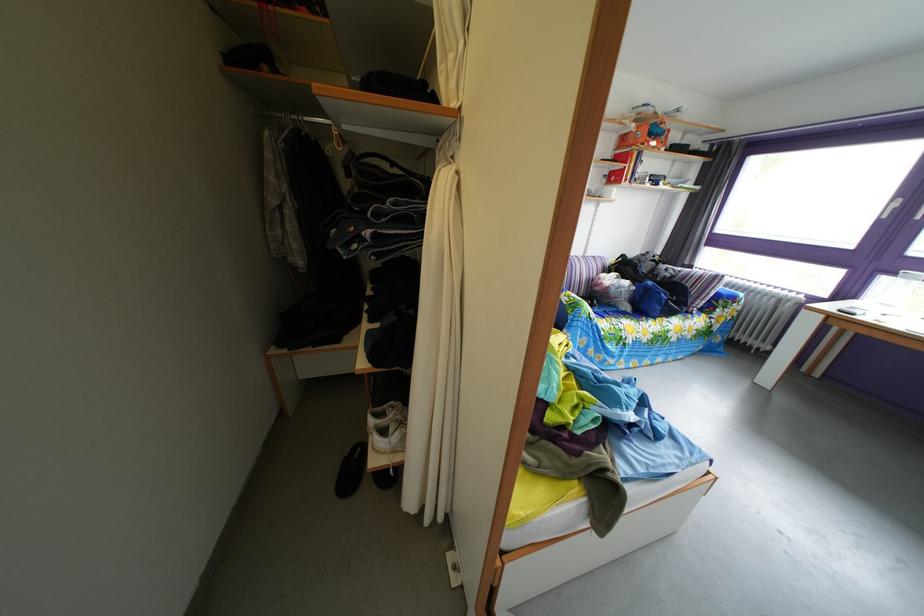
Find where to sit the sofa sitting surface. Please return your answer as a coordinate pair (x, y).

(638, 318)